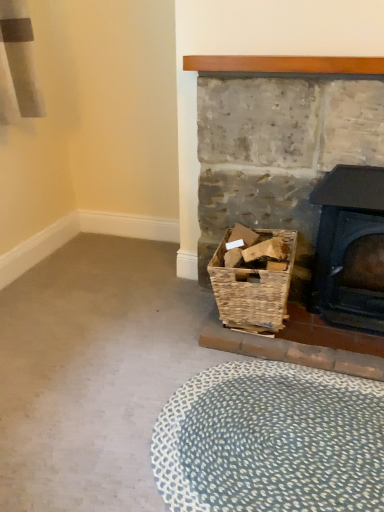
This screenshot has width=384, height=512. I want to click on free space in front of black cast iron wood burning stove at right, so 344,351.